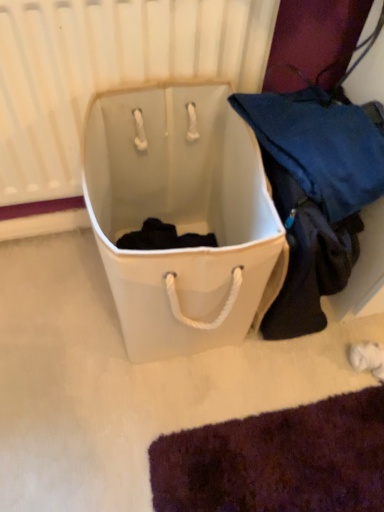
What do you see at coordinates (182, 218) in the screenshot?
I see `white canvas laundry basket at center` at bounding box center [182, 218].

The width and height of the screenshot is (384, 512). I want to click on white canvas laundry basket at center, so click(182, 218).

The height and width of the screenshot is (512, 384). Describe the element at coordinates (108, 71) in the screenshot. I see `white matte radiator at upper center` at that location.

Measure the distance between point (x=24, y=134) and camera.

Point (x=24, y=134) and camera are 36.46 inches apart from each other.

Image resolution: width=384 pixels, height=512 pixels. I want to click on white matte radiator at upper center, so click(108, 71).

Where is `white canvas laundry basket at center`? white canvas laundry basket at center is located at coordinates (182, 218).

Considering the positions of objects white canvas laundry basket at center and white matte radiator at upper center in the image provided, who is more to the right, white canvas laundry basket at center or white matte radiator at upper center?

From the viewer's perspective, white canvas laundry basket at center appears more on the right side.

Is white canvas laundry basket at center further to camera compared to white matte radiator at upper center?

No, it is in front of white matte radiator at upper center.

Is point (249, 172) positioned after point (21, 178)?

That is False.

From the image's perspective, who appears lower, white canvas laundry basket at center or white matte radiator at upper center?

white canvas laundry basket at center.

From a real-world perspective, between white canvas laundry basket at center and white matte radiator at upper center, who is vertically higher?

white matte radiator at upper center.

Does white canvas laundry basket at center have a greater width compared to white matte radiator at upper center?

Yes, white canvas laundry basket at center is wider than white matte radiator at upper center.

In the scene shown: Which of these two, white canvas laundry basket at center or white matte radiator at upper center, stands taller?

white matte radiator at upper center is taller.

Between white canvas laundry basket at center and white matte radiator at upper center, which one has larger size?

Bigger between the two is white canvas laundry basket at center.

Is white canvas laundry basket at center not within white matte radiator at upper center?

white canvas laundry basket at center lies outside white matte radiator at upper center's area.

Is white canvas laundry basket at center beside white matte radiator at upper center?

No.

Is white canvas laundry basket at center looking in the opposite direction of white matte radiator at upper center?

Absolutely, white canvas laundry basket at center is directed away from white matte radiator at upper center.

Can you tell me how much white canvas laundry basket at center and white matte radiator at upper center differ in facing direction?

There is a 0.888-degree angle between the facing directions of white canvas laundry basket at center and white matte radiator at upper center.

How much distance is there between white canvas laundry basket at center and white matte radiator at upper center?

white canvas laundry basket at center and white matte radiator at upper center are 8.97 inches apart.

Identify the location of radiator above the white canvas laundry basket at center (from the image's perspective). (108, 71).

Is white matte radiator at upper center to the left or to the right of white canvas laundry basket at center in the image?

Clearly, white matte radiator at upper center is on the left of white canvas laundry basket at center in the image.

Does white matte radiator at upper center come in front of white canvas laundry basket at center?

No.

Is point (223, 23) positioned behind point (188, 259)?

Yes, it is behind point (188, 259).

From the image's perspective, is white matte radiator at upper center above or below white canvas laundry basket at center?

Clearly, from the image's perspective, white matte radiator at upper center is above white canvas laundry basket at center.

From a real-world perspective, is white matte radiator at upper center on top of white canvas laundry basket at center?

Yes, from a real-world perspective, white matte radiator at upper center is over white canvas laundry basket at center

Is white matte radiator at upper center wider than white canvas laundry basket at center?

Incorrect, the width of white matte radiator at upper center does not surpass that of white canvas laundry basket at center.

Considering the relative sizes of white matte radiator at upper center and white canvas laundry basket at center in the image provided, is white matte radiator at upper center shorter than white canvas laundry basket at center?

Incorrect, the height of white matte radiator at upper center does not fall short of that of white canvas laundry basket at center.

In the scene shown: Considering the sizes of white matte radiator at upper center and white canvas laundry basket at center in the image, is white matte radiator at upper center bigger or smaller than white canvas laundry basket at center?

white matte radiator at upper center is smaller than white canvas laundry basket at center.

Is white matte radiator at upper center outside of white canvas laundry basket at center?

white matte radiator at upper center lies outside white canvas laundry basket at center's area.

Is the surface of white matte radiator at upper center in direct contact with white canvas laundry basket at center?

No.

Is white matte radiator at upper center turned away from white canvas laundry basket at center?

Absolutely, white matte radiator at upper center is directed away from white canvas laundry basket at center.

How many degrees apart are the facing directions of white matte radiator at upper center and white canvas laundry basket at center?

There is a 0.888-degree angle between the facing directions of white matte radiator at upper center and white canvas laundry basket at center.

How far apart are white matte radiator at upper center and white canvas laundry basket at center?

The distance of white matte radiator at upper center from white canvas laundry basket at center is 8.97 inches.

Where is `radiator lying on the left of white canvas laundry basket at center`? radiator lying on the left of white canvas laundry basket at center is located at coordinates (108, 71).

You are a GUI agent. You are given a task and a screenshot of the screen. Output one action in this format:
    pyautogui.click(x=<x>, y=<y>)
    Task: Click on the luggage and bags on the right of white matte radiator at upper center
    This screenshot has width=384, height=512.
    Given the screenshot: What is the action you would take?
    pyautogui.click(x=182, y=218)

Find the location of `luggage and bags in front of the white matte radiator at upper center`. luggage and bags in front of the white matte radiator at upper center is located at coordinates (182, 218).